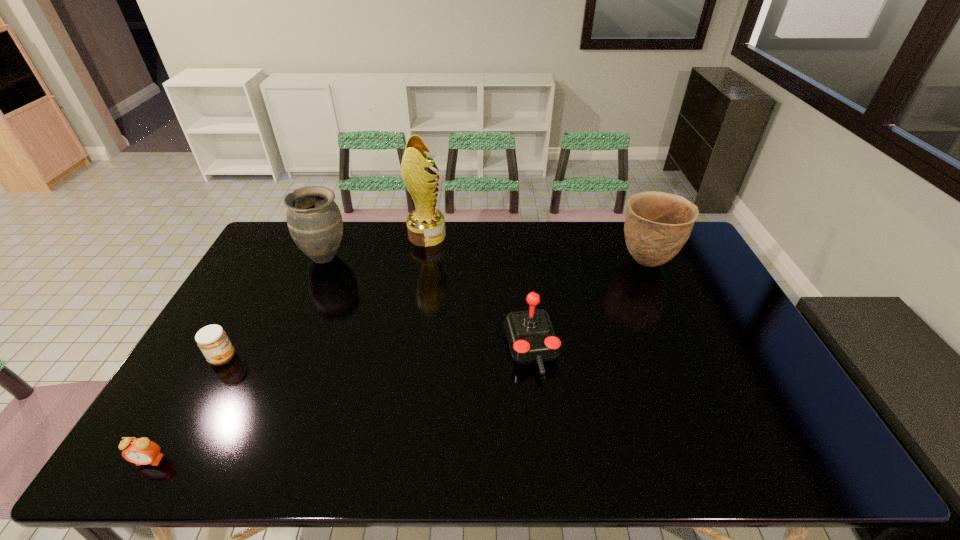
Identify the location of free spot between the alarm clock and the third shortest object. (340, 405).

In order to click on empty space between the tallest object and the urn in this screenshot , I will do `click(376, 246)`.

Find the location of a particular element. This screenshot has width=960, height=540. vacant area that lies between the urn and the nearest object is located at coordinates (237, 359).

This screenshot has width=960, height=540. I want to click on vacant point located between the third object from left to right and the award, so click(x=376, y=246).

Identify the location of free space between the fourth tallest object and the jam. (377, 354).

Where is `unoccupied position between the nearest object and the fourth tallest object`? This screenshot has height=540, width=960. unoccupied position between the nearest object and the fourth tallest object is located at coordinates (340, 405).

In order to click on blank region between the pottery and the urn in this screenshot , I will do `click(486, 260)`.

Locate an element on the screen. vacant space that's between the rightmost object and the jam is located at coordinates pyautogui.click(x=435, y=310).

Identify which object is the fifth closest to the fourth tallest object. Please provide its 2D coordinates. Your answer should be formatted as a tuple, i.e. [(x, y)], where the tuple contains the x and y coordinates of a point satisfying the conditions above.

[(141, 451)]

Where is `object identified as the fifth closest to the rightmost object`? object identified as the fifth closest to the rightmost object is located at coordinates (141, 451).